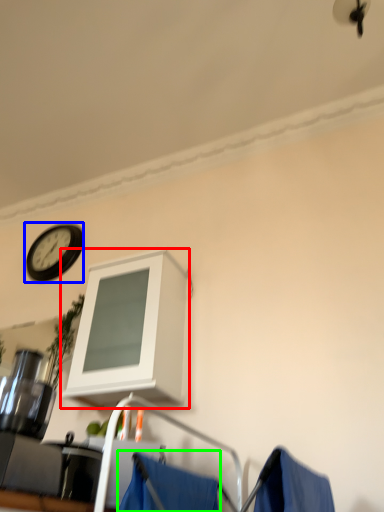
Question: Which object is positioned farthest from cabinetry (highlighted by a red box)? Select from wall clock (highlighted by a blue box) and curtain (highlighted by a green box).

Choices:
 (A) wall clock
 (B) curtain

Answer: (A)